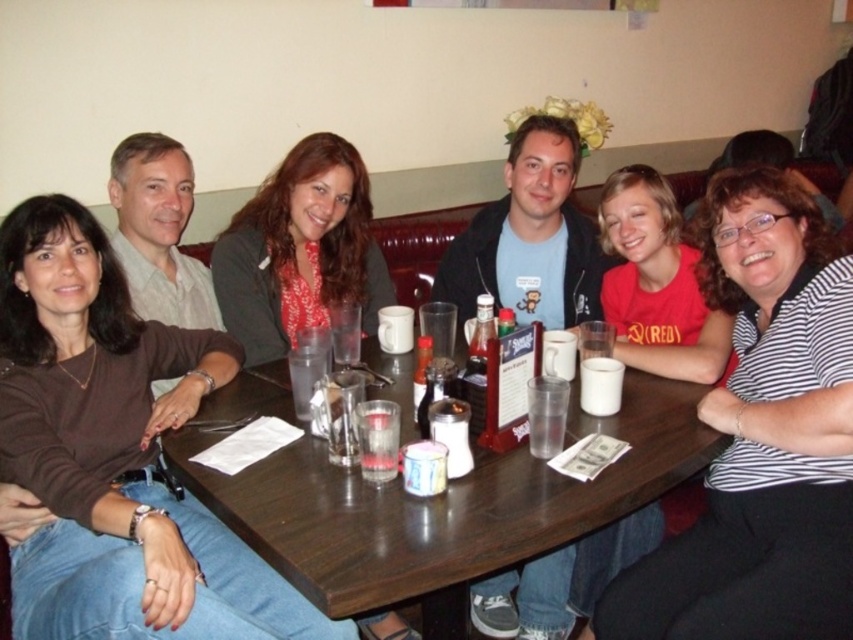
You are a photographer taking a picture of the dining table. You notice two points marked on the table. The first point is at coordinate point (277, 374) and the second point is at coordinate point (550, 422). Which point is closer to the camera?

Point (277, 374) is closer to the camera than point (550, 422) because it is further to the camera than the other point.

From the picture: You are a photographer taking a picture of the dining table. You notice two points marked on the table. Which point, point (x=714, y=211) or point (x=395, y=380), is closer to your camera?

Point (x=714, y=211) is closer to the camera than point (x=395, y=380).

Where is the wooden table at center located in the image?

The wooden table at center is located at point (x=444, y=508).